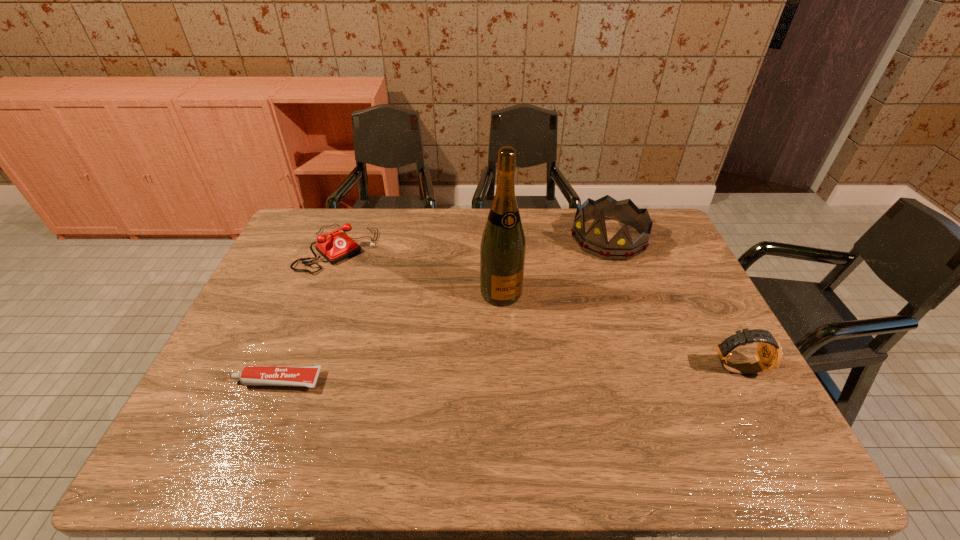
The height and width of the screenshot is (540, 960). I want to click on vacant space located on the front-facing side of the third object from right to left, so click(x=546, y=378).

Locate an element on the screen. vacant region located 0.400m at the front of the second tallest object with jewels is located at coordinates (523, 332).

Locate an element on the screen. This screenshot has height=540, width=960. free space located 0.150m at the front of the second tallest object with jewels is located at coordinates click(x=568, y=282).

Where is `free space located 0.070m at the front of the second tallest object with jewels`? free space located 0.070m at the front of the second tallest object with jewels is located at coordinates (581, 269).

Identify the location of free space located 0.220m on the dial of the telephone. (397, 304).

Where is `vacant region located on the dial of the telephone`? The image size is (960, 540). vacant region located on the dial of the telephone is located at coordinates pos(437,339).

This screenshot has width=960, height=540. What are the coordinates of `vacant space situated 0.080m on the dial of the telephone` in the screenshot? It's located at (372, 280).

Image resolution: width=960 pixels, height=540 pixels. Find the location of `tiara at the far edge`. tiara at the far edge is located at coordinates (595, 241).

The image size is (960, 540). Identify the location of telephone that is at the far edge. (338, 246).

Where is `object that is positioned at the near edge`? object that is positioned at the near edge is located at coordinates (303, 376).